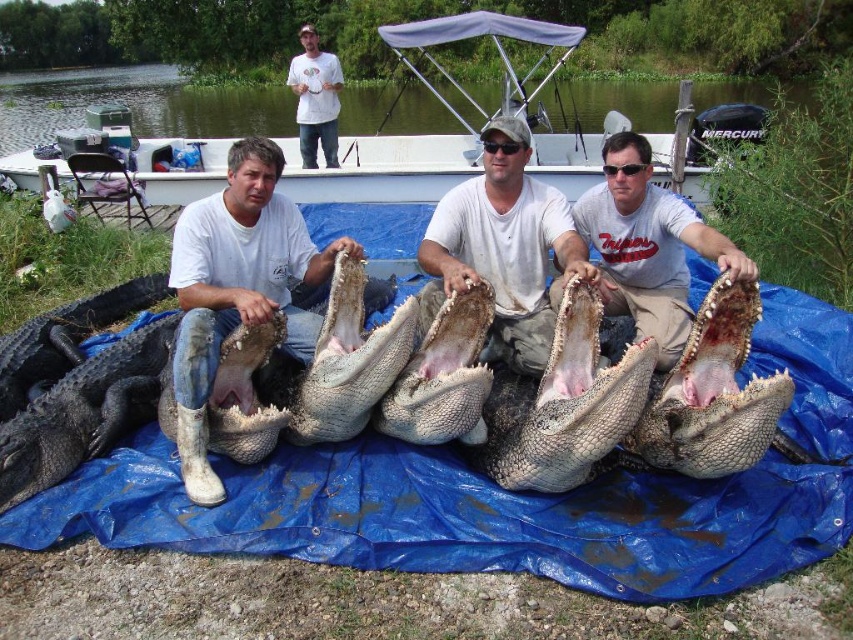
Does white plastic boat at center come behind dark gray scaly crocodile at center?

Yes, it is behind dark gray scaly crocodile at center.

Which is behind, point (581, 148) or point (68, 404)?

Point (581, 148)

Image resolution: width=853 pixels, height=640 pixels. Describe the element at coordinates (425, 132) in the screenshot. I see `white plastic boat at center` at that location.

At what (x,y) coordinates should I click in order to perform the action: click on white plastic boat at center. Please return your answer as a coordinate pair (x, y). Looking at the image, I should click on (425, 132).

Which is behind, point (563, 170) or point (312, 86)?

The point (312, 86) is more distant.

Can you confirm if white plastic boat at center is bigger than white t-shirt at upper center?

Yes, white plastic boat at center is bigger than white t-shirt at upper center.

Is point (216, 182) positioned after point (308, 74)?

That is False.

The height and width of the screenshot is (640, 853). I want to click on white plastic boat at center, so click(425, 132).

Does white matte boots at lower left have a greater height compared to white t-shirt at upper center?

No, white matte boots at lower left is not taller than white t-shirt at upper center.

Is point (257, 282) farther from camera compared to point (340, 76)?

No, (257, 282) is in front of (340, 76).

Where is `white matte boots at lower left`? white matte boots at lower left is located at coordinates (x=236, y=289).